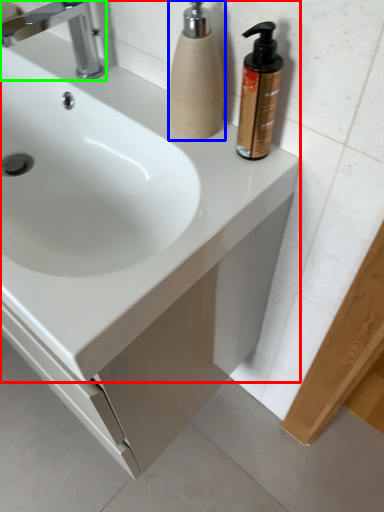
Question: Based on their relative distances, which object is nearer to sink (highlighted by a red box)? Choose from soap dispenser (highlighted by a blue box) and tap (highlighted by a green box).

Choices:
 (A) soap dispenser
 (B) tap

Answer: (A)